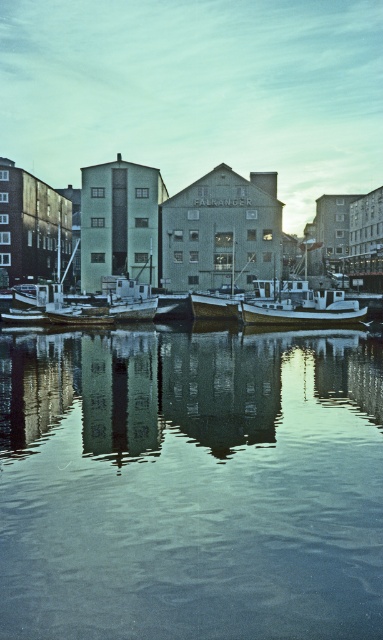
Does smooth reflective water at center have a greater height compared to white matte boat at center?

No, smooth reflective water at center is not taller than white matte boat at center.

Measure the distance from smooth reflective water at center to white matte boat at center.

smooth reflective water at center and white matte boat at center are 84.20 feet apart.

This screenshot has width=383, height=640. I want to click on smooth reflective water at center, so click(191, 484).

Identify the location of smooth reflective water at center. This screenshot has height=640, width=383. (191, 484).